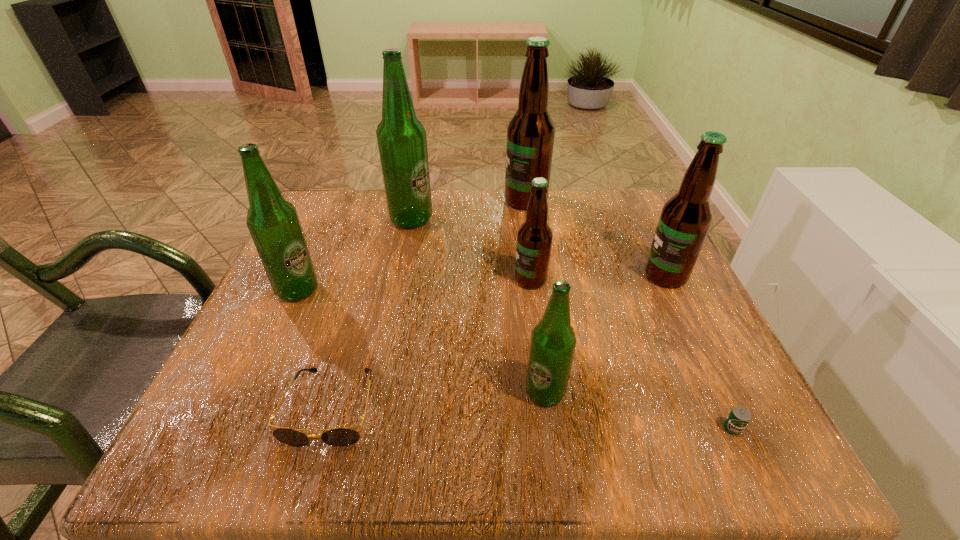
Locate an element on the screen. sunglasses is located at coordinates (342, 436).

Find the location of a particular element. beer can is located at coordinates (739, 417).

Identify the location of free region located on the label of the biggest brown beer bottle. The width and height of the screenshot is (960, 540). (367, 200).

Where is `free region located 0.110m on the label of the biggest brown beer bottle`? Image resolution: width=960 pixels, height=540 pixels. free region located 0.110m on the label of the biggest brown beer bottle is located at coordinates (461, 200).

Identify the location of vacant region located on the label of the biggest brown beer bottle. (410, 200).

The height and width of the screenshot is (540, 960). Find the location of `free region located 0.160m on the label of the second beer bottle from left to right`. free region located 0.160m on the label of the second beer bottle from left to right is located at coordinates (500, 220).

Locate an element on the screen. blank space located 0.120m on the label of the second smallest brown beer bottle is located at coordinates (586, 276).

Image resolution: width=960 pixels, height=540 pixels. I want to click on free spot located on the label of the second smallest brown beer bottle, so click(x=586, y=276).

Where is `vacant area located on the label of the second smallest brown beer bottle`? The height and width of the screenshot is (540, 960). vacant area located on the label of the second smallest brown beer bottle is located at coordinates (497, 276).

Identify the location of free spot located 0.370m on the label of the leftmost green beer bottle. Image resolution: width=960 pixels, height=540 pixels. (507, 290).